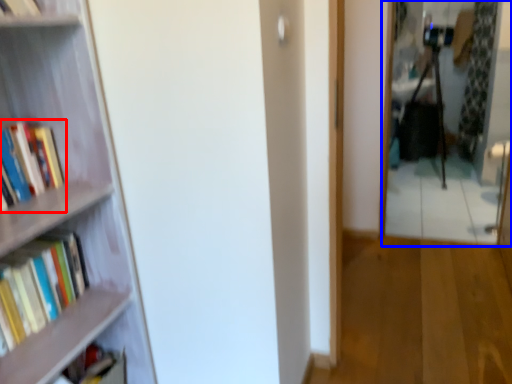
Question: Which point is further to the camera, book (highlighted by a red box) or mirror (highlighted by a blue box)?

Choices:
 (A) book
 (B) mirror

Answer: (B)